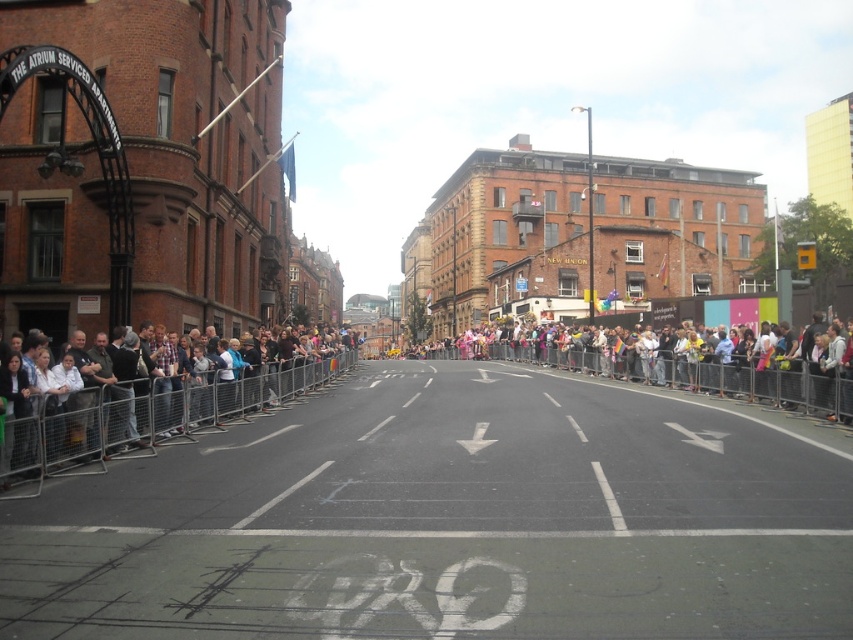
Does point (306, 380) come farther from viewer compared to point (608, 362)?

No, (306, 380) is closer to viewer.

Who is lower down, metal barricade at left or multicolored fabric crowd at center?

Positioned lower is multicolored fabric crowd at center.

Image resolution: width=853 pixels, height=640 pixels. I want to click on metal barricade at left, so click(x=141, y=419).